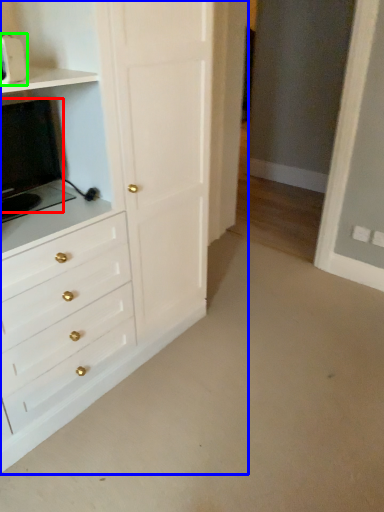
Question: Based on their relative distances, which object is farther from appliance (highlighted by a red box)? Choose from chest of drawers (highlighted by a blue box) and appliance (highlighted by a green box).

Choices:
 (A) chest of drawers
 (B) appliance

Answer: (B)